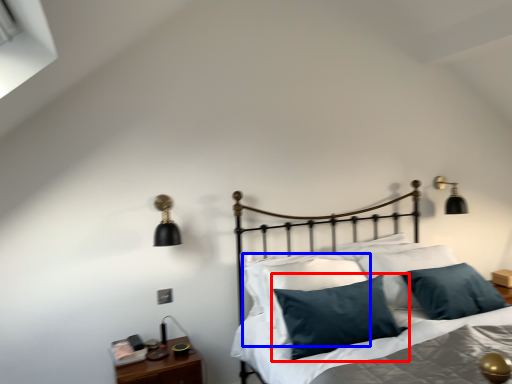
Question: Which object appears closest to the camera in this image, pillow (highlighted by a red box) or pillow (highlighted by a blue box)?

Choices:
 (A) pillow
 (B) pillow

Answer: (A)